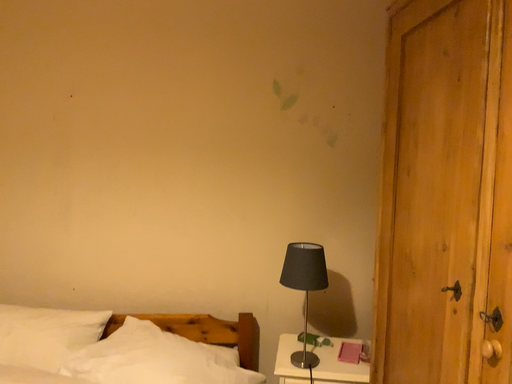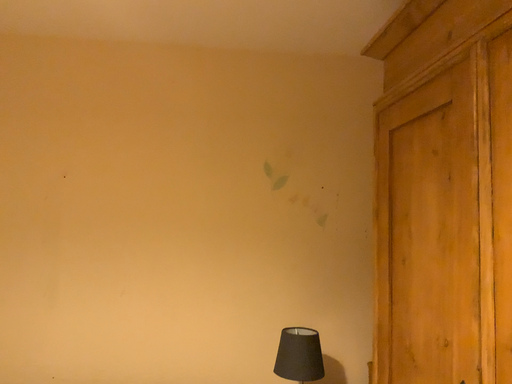
Question: Which way did the camera rotate in the video?

Choices:
 (A) rotated downward
 (B) rotated upward

Answer: (B)